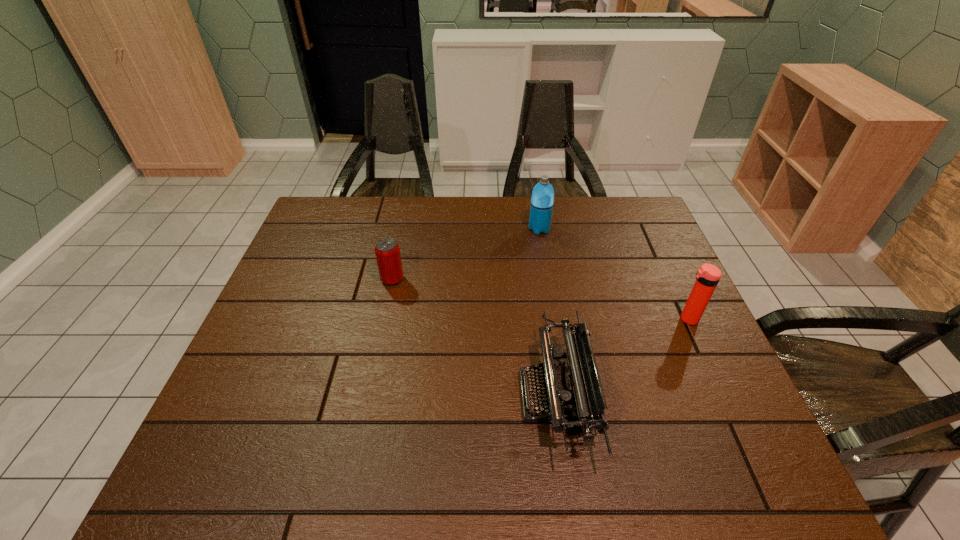
You are a GUI agent. You are given a task and a screenshot of the screen. Output one action in this format:
    pyautogui.click(x=<x>, y=<y>)
    Task: Click on the free area in between the farthest object and the rightmost object
    
    Given the screenshot: What is the action you would take?
    pyautogui.click(x=613, y=274)

The width and height of the screenshot is (960, 540). What are the coordinates of `the third closest object to the farthest object` in the screenshot? It's located at pyautogui.click(x=707, y=277).

Locate which object ranks third in proximity to the right thermos bottle. Please provide its 2D coordinates. Your answer should be formatted as a tuple, i.e. [(x, y)], where the tuple contains the x and y coordinates of a point satisfying the conditions above.

[(387, 251)]

I want to click on free location that satisfies the following two spatial constraints: 1. on the front side of the right thermos bottle; 2. on the left side of the leftmost object, so click(x=384, y=319).

This screenshot has width=960, height=540. Find the location of `free space that satisfies the following two spatial constraints: 1. on the front side of the farthest object; 2. on the typing side of the nearest object`. free space that satisfies the following two spatial constraints: 1. on the front side of the farthest object; 2. on the typing side of the nearest object is located at coordinates (566, 396).

Locate an element on the screen. This screenshot has height=540, width=960. free space that satisfies the following two spatial constraints: 1. on the front side of the third farthest object; 2. on the left side of the second farthest object is located at coordinates (384, 319).